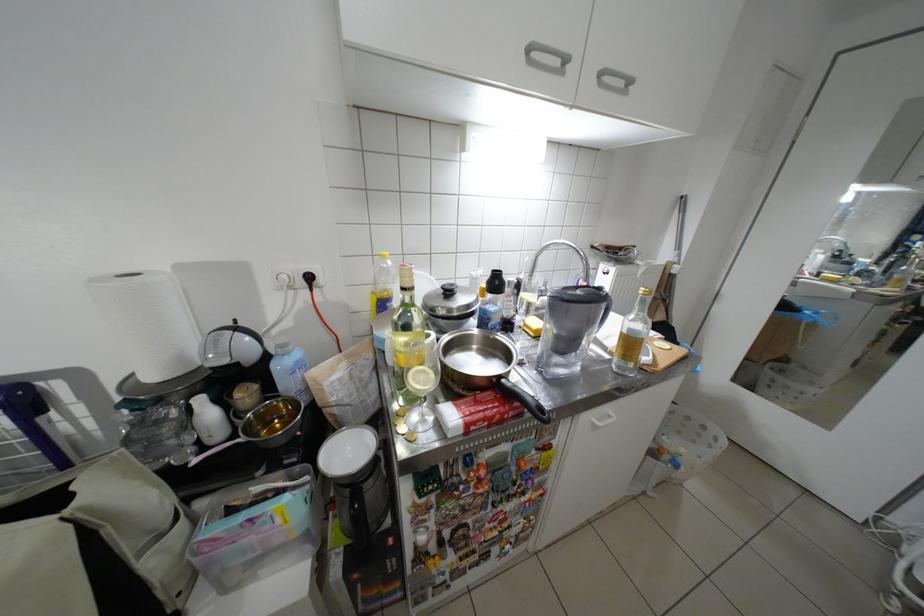
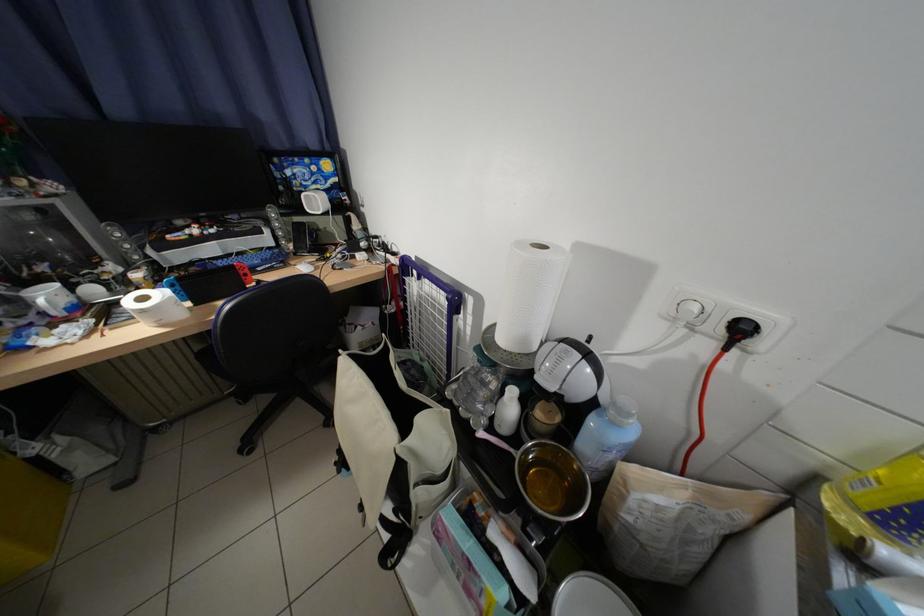
Where in the second image is the point corresponding to point (164, 378) from the first image?

(514, 341)